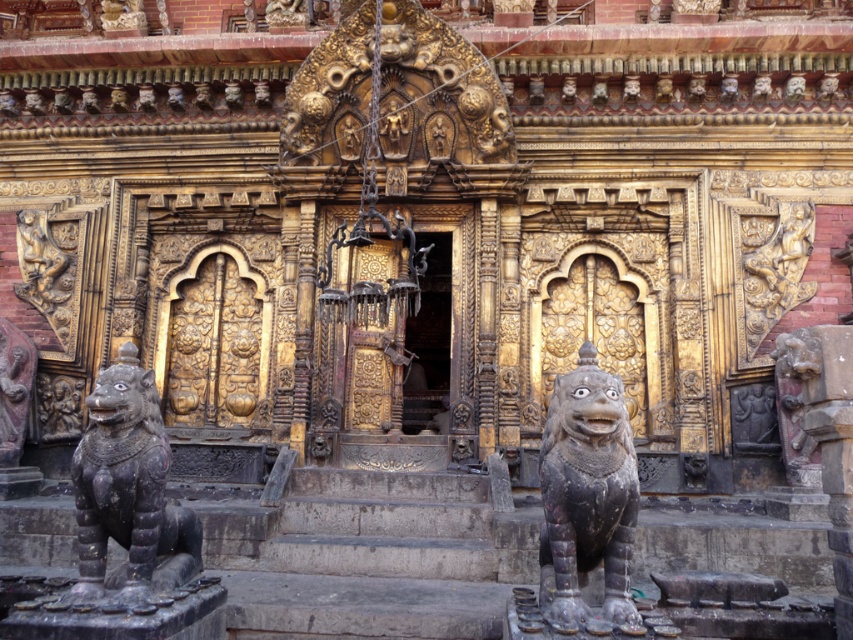
Can you confirm if dark gray stone lion at center is shorter than black stone lion at lower left?

No.

Which is behind, point (546, 449) or point (154, 541)?

The point (546, 449) is more distant.

I want to click on dark gray stone lion at center, so click(585, 493).